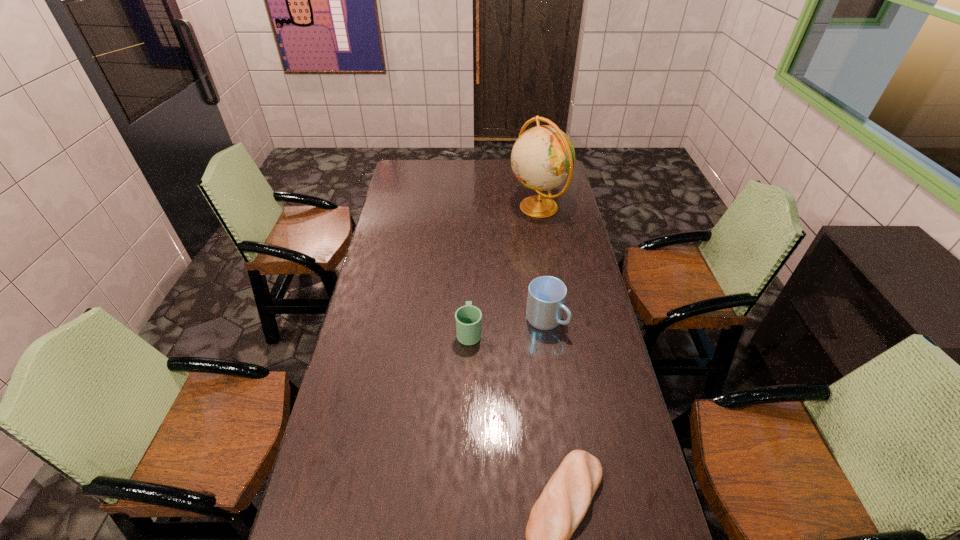
Locate an element on the screen. Image resolution: width=960 pixels, height=540 pixels. free space between the right mug and the farthest object is located at coordinates (541, 264).

Where is `free spot between the shorter mug and the tallest object`? free spot between the shorter mug and the tallest object is located at coordinates (503, 269).

Find the location of a particular element. This screenshot has height=540, width=960. free spot between the right mug and the second shortest object is located at coordinates (507, 326).

Identify which object is the third closest to the third tallest object. Please provide its 2D coordinates. Your answer should be formatted as a tuple, i.e. [(x, y)], where the tuple contains the x and y coordinates of a point satisfying the conditions above.

[(543, 157)]

Identify the location of object that is the second closest to the tallest object. The image size is (960, 540). (468, 318).

Locate an element on the screen. This screenshot has height=540, width=960. free space that satisfies the following two spatial constraints: 1. on the back side of the tallest object; 2. on the left side of the right mug is located at coordinates (529, 207).

This screenshot has width=960, height=540. I want to click on vacant space that satisfies the following two spatial constraints: 1. on the side of the second shortest object with the handle; 2. on the right side of the right mug, so click(469, 320).

Image resolution: width=960 pixels, height=540 pixels. I want to click on vacant region that satisfies the following two spatial constraints: 1. on the side of the shorter mug with the handle; 2. on the right side of the taller mug, so 469,320.